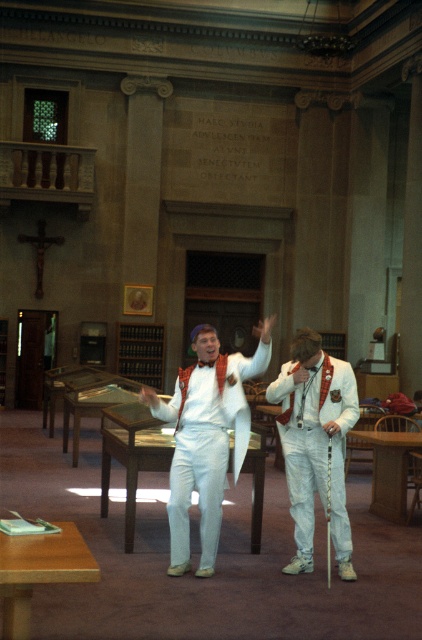
Question: Among these points, which one is nearest to the camera?

Choices:
 (A) (189, 502)
 (B) (411, 433)

Answer: (A)

Question: Which point is farther from the camera taking this photo?

Choices:
 (A) (376, 451)
 (B) (294, 452)
 (C) (205, 486)

Answer: (A)

Question: Does white satin suit at center appear on the right side of light brown wooden table at center?

Choices:
 (A) yes
 (B) no

Answer: (B)

Question: Is white cotton suit at center below wooden table at center?

Choices:
 (A) yes
 (B) no

Answer: (B)

Question: Which object is the farthest from the wooden table at center?

Choices:
 (A) white satin suit at center
 (B) white cotton suit at center

Answer: (B)

Question: In this image, where is white cotton suit at center located relative to wooden table at center?

Choices:
 (A) above
 (B) below

Answer: (A)